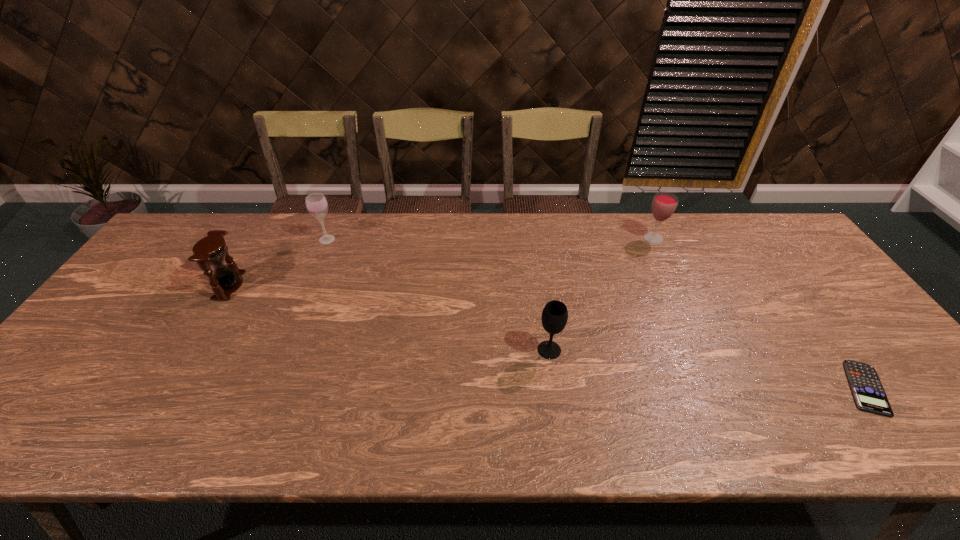
Image resolution: width=960 pixels, height=540 pixels. In order to click on vacant space in between the second nearest object and the calculator in this screenshot , I will do `click(708, 369)`.

Image resolution: width=960 pixels, height=540 pixels. In order to click on empty space between the leftmost object and the nearest object in this screenshot , I will do pos(547,337).

Where is `vacant area that lies between the fourth object from left to right and the fourth farthest object`? vacant area that lies between the fourth object from left to right and the fourth farthest object is located at coordinates (601, 294).

Choose which object is the fourth nearest neighbor to the nearest wineglass. Please provide its 2D coordinates. Your answer should be formatted as a tuple, i.e. [(x, y)], where the tuple contains the x and y coordinates of a point satisfying the conditions above.

[(211, 250)]

Locate which object ranks second in proximity to the calculator. Please provide its 2D coordinates. Your answer should be formatted as a tuple, i.e. [(x, y)], where the tuple contains the x and y coordinates of a point satisfying the conditions above.

[(554, 317)]

Identify which wineglass is the closest to the hourglass. Please provide its 2D coordinates. Your answer should be formatted as a tuple, i.e. [(x, y)], where the tuple contains the x and y coordinates of a point satisfying the conditions above.

[(316, 203)]

This screenshot has height=540, width=960. I want to click on wineglass that stands as the closest to the nearest wineglass, so click(x=664, y=204).

This screenshot has width=960, height=540. Identify the location of vacant space that satisfies the following two spatial constraints: 1. on the back side of the fourth object from right to left; 2. on the left side of the third farthest object. (257, 239).

Locate an element on the screen. vacant area that satisfies the following two spatial constraints: 1. on the back side of the rightmost wineglass; 2. on the left side of the leftmost wineglass is located at coordinates [x=327, y=239].